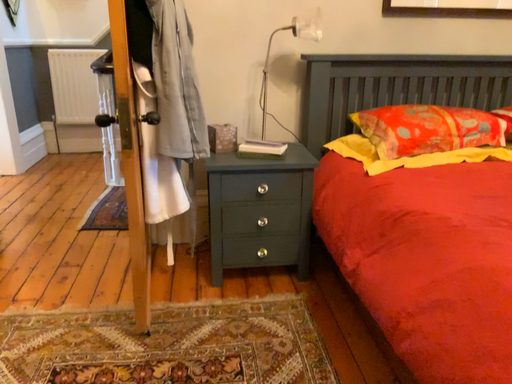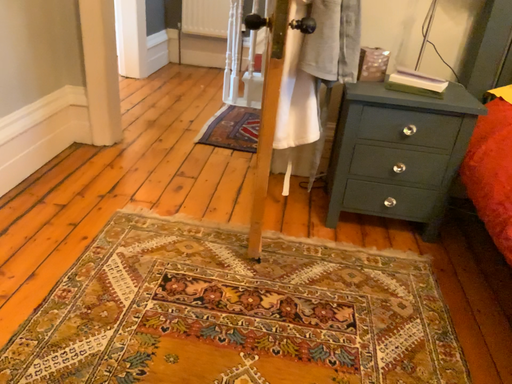
Question: How did the camera likely rotate when shooting the video?

Choices:
 (A) rotated upward
 (B) rotated downward

Answer: (B)